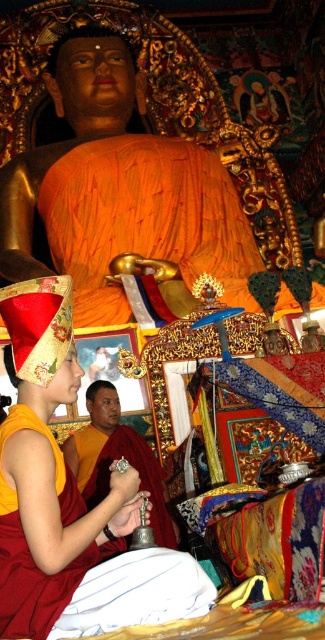
Is maroon silk robe at lower left shorter than smooth gold bell at center?

Yes.

Between point (68, 515) and point (83, 448), which one is positioned behind?

Point (83, 448)

Identify the location of maroon silk robe at lower left. (86, 568).